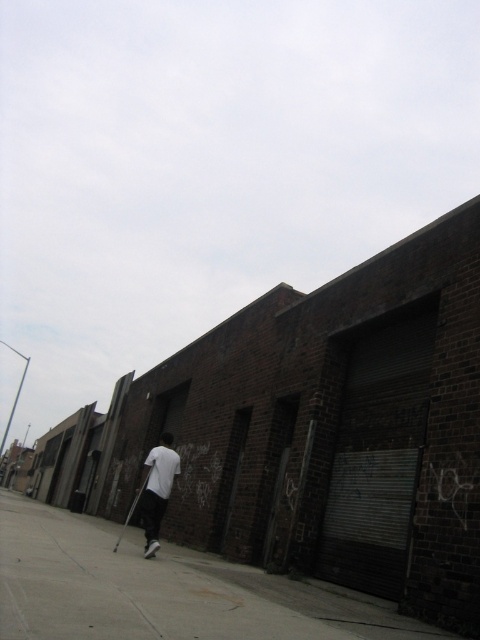
You are standing on the sidewalk and notice the gray concrete sidewalk at lower center and the white matte shirt at center. Which object is positioned to the right of the other?

The gray concrete sidewalk at lower center is to the right of the white matte shirt at center.

You are a photographer standing on the sidewalk and want to take a photo of the white matte shirt at center. Since the gray concrete sidewalk at lower center is under it, will the shirt be visible in the photo?

The gray concrete sidewalk at lower center is positioned under the white matte shirt at center, so the shirt will be visible in the photo as it is above the sidewalk.